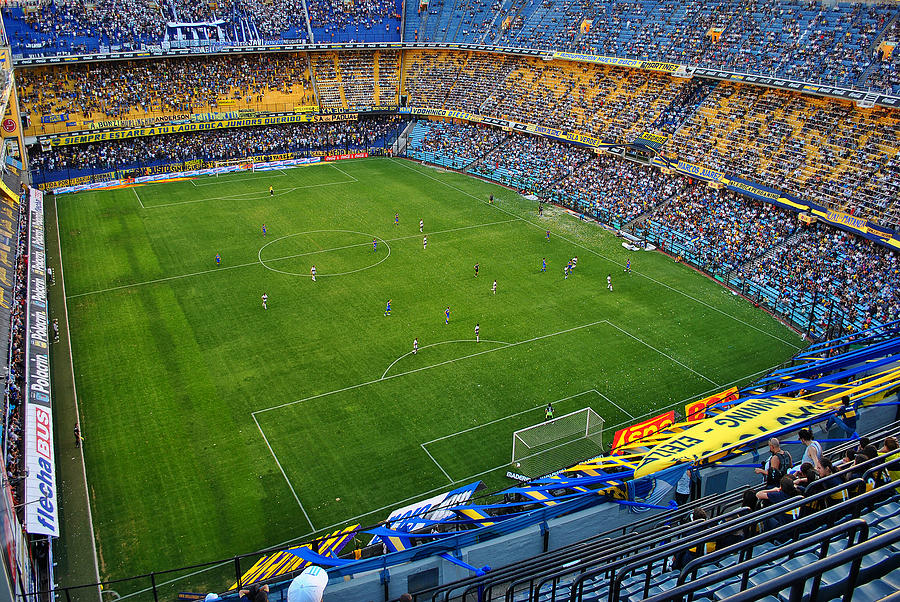
At what (x,y) coordinates should I click in order to perform the action: click on fans. Please return your answer as a coordinate pair (x, y). Image resolution: width=900 pixels, height=602 pixels. Looking at the image, I should click on pyautogui.click(x=724, y=225), pyautogui.click(x=625, y=196), pyautogui.click(x=528, y=158).